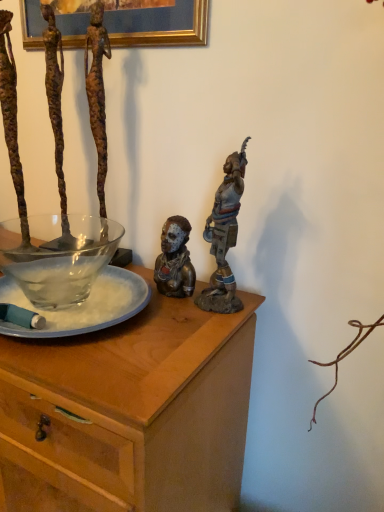
The height and width of the screenshot is (512, 384). In order to click on free space between bronze statue at upper right, the first person in the right-to-left sequence, and clear glass plate at center in this screenshot , I will do `click(172, 326)`.